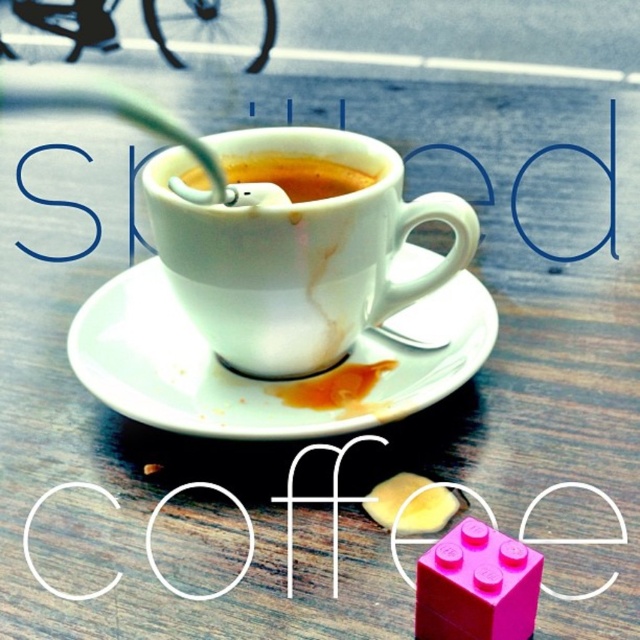
Question: From the image, what is the correct spatial relationship of white ceramic cup at center in relation to smooth porcelain cup at center?

Choices:
 (A) above
 (B) below

Answer: (B)

Question: Which of the following is the farthest from the observer?

Choices:
 (A) (376, 176)
 (B) (292, 340)

Answer: (A)

Question: Considering the real-world distances, which object is farthest from the smooth porcelain cup at center?

Choices:
 (A) white ceramic cup at center
 (B) white ceramic saucer at center

Answer: (B)

Question: Is white ceramic cup at center smaller than white ceramic saucer at center?

Choices:
 (A) no
 (B) yes

Answer: (B)

Question: Is white ceramic saucer at center in front of smooth porcelain cup at center?

Choices:
 (A) yes
 (B) no

Answer: (A)

Question: Considering the real-world distances, which object is farthest from the white ceramic saucer at center?

Choices:
 (A) white ceramic cup at center
 (B) smooth porcelain cup at center

Answer: (B)